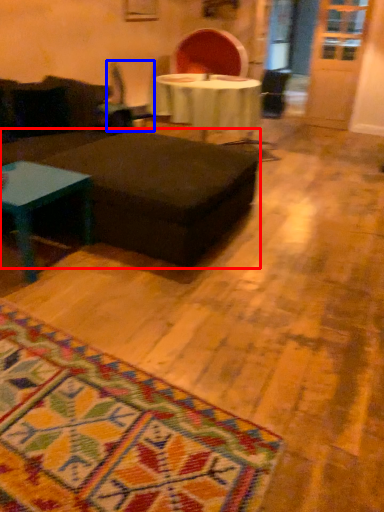
Question: Which of the following is the closest to the observer, table (highlighted by a red box) or swivel chair (highlighted by a blue box)?

Choices:
 (A) table
 (B) swivel chair

Answer: (A)